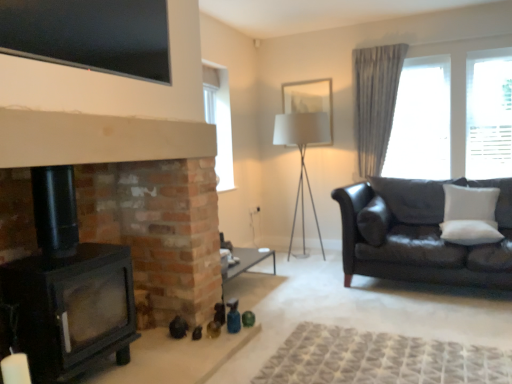
Question: From a real-world perspective, is white fabric picture frame at upper center above or below gray fabric curtain at upper right?

Choices:
 (A) below
 (B) above

Answer: (B)

Question: Considering the relative positions of white fabric picture frame at upper center and gray fabric curtain at upper right in the image provided, is white fabric picture frame at upper center to the left or to the right of gray fabric curtain at upper right?

Choices:
 (A) left
 (B) right

Answer: (A)

Question: Based on their relative distances, which object is farther from the white soft cushion at right, placed as the 2th pillow when sorted from front to back?

Choices:
 (A) black glass tv at upper center
 (B) black matte fireplace at lower left
 (C) white fabric picture frame at upper center
 (D) sheer fabric curtain at right
 (E) white fabric lampshade at center

Answer: (A)

Question: Estimate the real-world distances between objects in this image. Which object is farther from the white fabric lampshade at center?

Choices:
 (A) sheer fabric curtain at right
 (B) black glass tv at upper center
 (C) white fabric picture frame at upper center
 (D) black matte fireplace at lower left
 (E) white soft cushion at right, placed as the 2th pillow when sorted from front to back

Answer: (B)